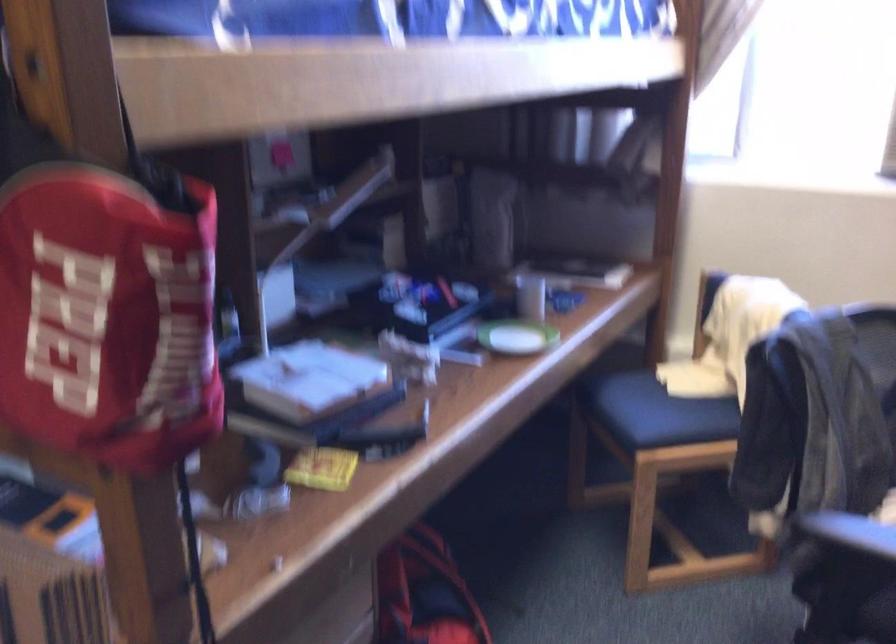
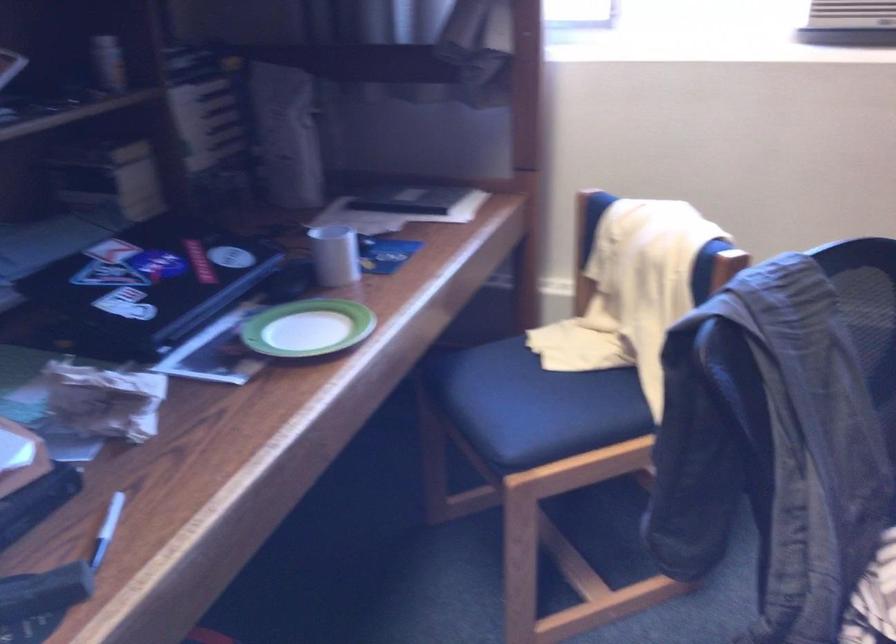
Question: The first image is from the beginning of the video and the second image is from the end. How did the camera likely rotate when shooting the video?

Choices:
 (A) Left
 (B) Right
 (C) Up
 (D) Down

Answer: (B)